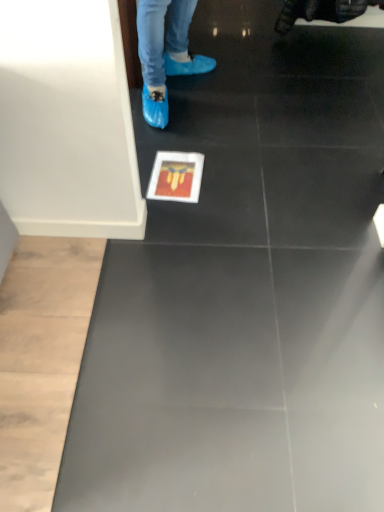
What do you see at coordinates (179, 386) in the screenshot? I see `black smooth concrete at center` at bounding box center [179, 386].

Measure the distance between black smooth concrete at center and camera.

They are 3.55 feet apart.

You are a GUI agent. You are given a task and a screenshot of the screen. Output one action in this format:
    pyautogui.click(x=<x>, y=<y>)
    Task: Click on the black smooth concrete at center
    The image size is (384, 512).
    Given the screenshot: What is the action you would take?
    pyautogui.click(x=179, y=386)

The width and height of the screenshot is (384, 512). Find the location of `black smooth concrete at center`. black smooth concrete at center is located at coordinates (179, 386).